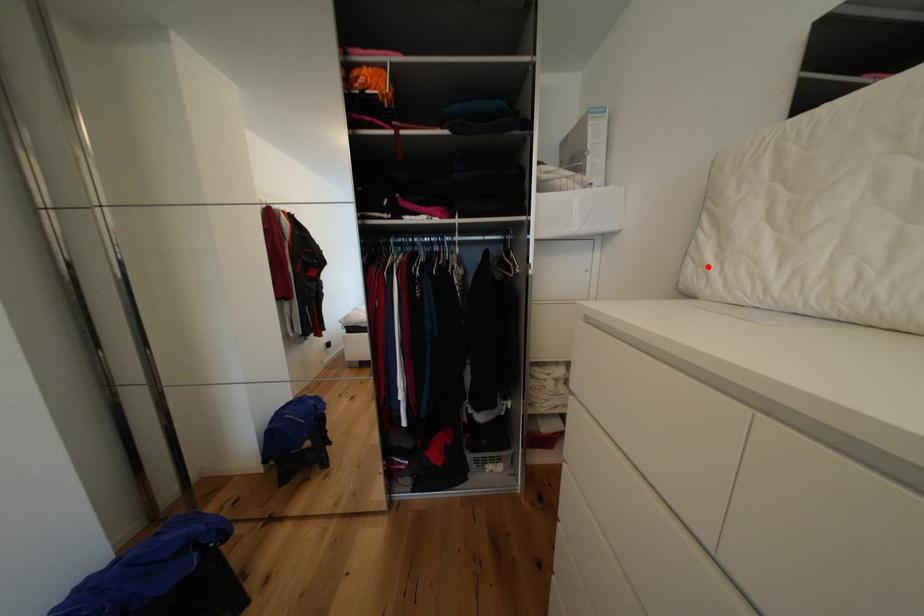
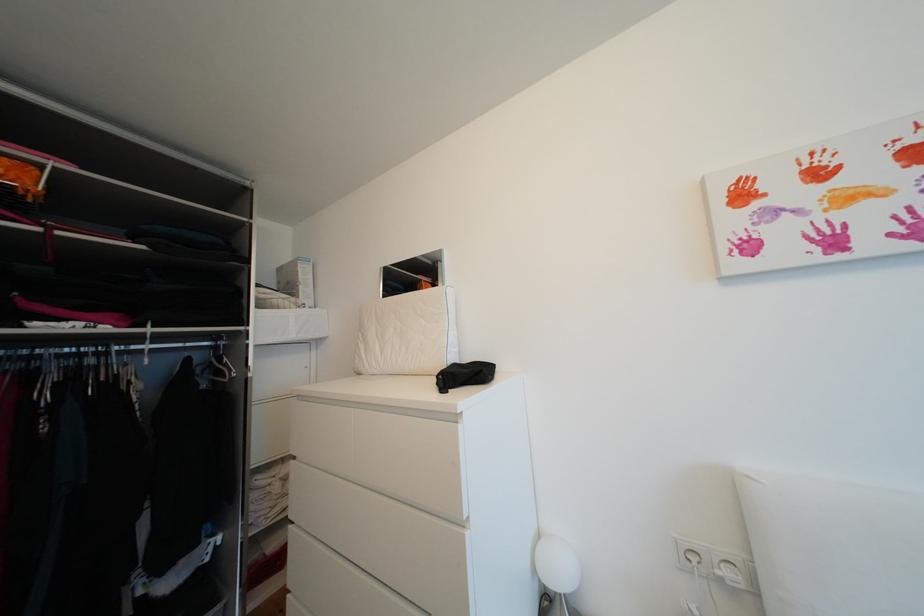
Locate, in the second image, the point that corresponds to the highlighted location in the first image.

(368, 359)